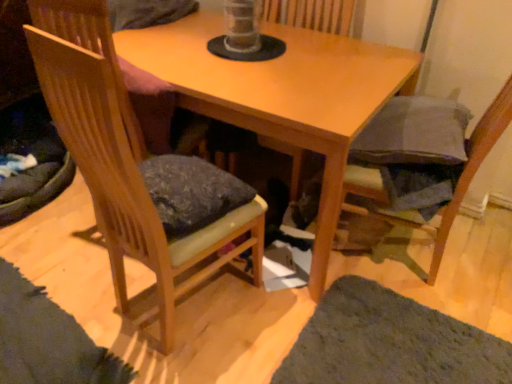
This screenshot has width=512, height=384. In order to click on free space below wooden chair at left, which appears as the 2th chair when viewed from the right (from a real-world perspective) in this screenshot , I will do `click(197, 305)`.